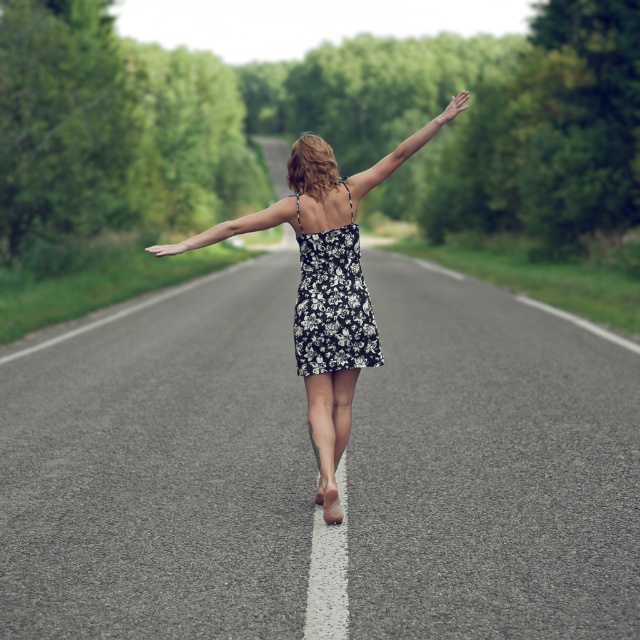
You are a photographer trying to capture the person in the floral dress at center and the smooth skin arm at center. If you want to focus on the wider object, which one should you aim for?

The floral dress at center is wider than the smooth skin arm at center, so you should aim for the floral dress at center.

You are an artist trying to sketch the scene. You notice the point at coordinates [232,227]. What does this point represent?

The point at coordinates [232,227] represents the smooth skin arm at center.